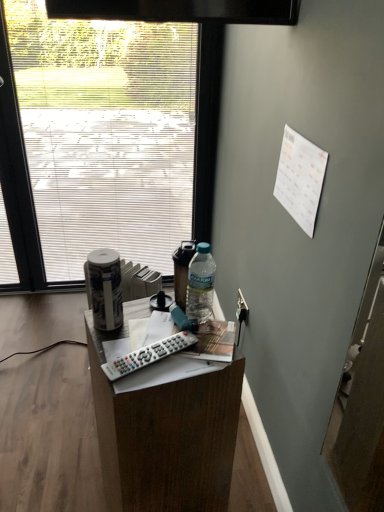
What do you see at coordinates (105, 288) in the screenshot? I see `white glossy canister at left` at bounding box center [105, 288].

At what (x,y) coordinates should I click in order to perform the action: click on white plastic remote control at center. Please return your answer as a coordinate pair (x, y). The width and height of the screenshot is (384, 512). Looking at the image, I should click on [x=148, y=355].

This screenshot has height=512, width=384. I want to click on black plastic power outlet at lower right, so click(x=242, y=309).

You are a GUI agent. You are given a task and a screenshot of the screen. Output one action in this format:
    pyautogui.click(x=<x>, y=<y>)
    Task: Click on the wooden desk at center
    The width and height of the screenshot is (384, 512).
    Given the screenshot: What is the action you would take?
    pyautogui.click(x=165, y=434)

You are a GUI agent. You are given a task and a screenshot of the screen. Output one action in this format:
    pyautogui.click(x=<x>, y=<y>)
    Task: Click on the bottle above the frosted glass window at upper left (from a real-world perspective)
    
    Given the screenshot: What is the action you would take?
    pyautogui.click(x=105, y=288)

Measure the distance from white glossy canister at left to frosted glass window at upper left.

5.74 feet.

Is white glossy canister at left next to frosted glass window at upper left and touching it?

No, white glossy canister at left is not in contact with frosted glass window at upper left.

From a real-world perspective, is white glossy canister at left above or below frosted glass window at upper left?

In terms of real-world spatial position, white glossy canister at left is above frosted glass window at upper left.

Is black plastic power outlet at lower right facing away from white glossy canister at left?

No, black plastic power outlet at lower right is not facing away from white glossy canister at left.

From a real-world perspective, which is physically above, black plastic power outlet at lower right or white glossy canister at left?

white glossy canister at left is physically above.

Does black plastic power outlet at lower right lie behind white glossy canister at left?

Yes, the depth of black plastic power outlet at lower right is greater than that of white glossy canister at left.

From the image's perspective, does black plastic power outlet at lower right appear lower than white glossy canister at left?

Yes, from the image's perspective, black plastic power outlet at lower right is beneath white glossy canister at left.

Looking at this image, which of these two, wooden desk at center or frosted glass window at upper left, stands shorter?

Standing shorter between the two is wooden desk at center.

Is wooden desk at center not close to frosted glass window at upper left?

wooden desk at center is positioned a significant distance from frosted glass window at upper left.

Between wooden desk at center and frosted glass window at upper left, which one is positioned in front?

wooden desk at center is closer to the camera.

Considering the positions of objects frosted glass window at upper left and black plastic power outlet at lower right in the image provided, who is more to the left, frosted glass window at upper left or black plastic power outlet at lower right?

frosted glass window at upper left is more to the left.

Could you measure the distance between frosted glass window at upper left and black plastic power outlet at lower right?

The distance of frosted glass window at upper left from black plastic power outlet at lower right is 5.17 feet.

Considering the relative positions of frosted glass window at upper left and black plastic power outlet at lower right in the image provided, is frosted glass window at upper left in front of black plastic power outlet at lower right?

No, frosted glass window at upper left is further to the viewer.

Is point (165, 153) closer to camera compared to point (245, 312)?

No, (165, 153) is behind (245, 312).

Which of these two, white glossy canister at left or black plastic power outlet at lower right, is smaller?

black plastic power outlet at lower right.

Can we say white glossy canister at left lies outside black plastic power outlet at lower right?

Indeed, white glossy canister at left is completely outside black plastic power outlet at lower right.

Is white glossy canister at left taller or shorter than black plastic power outlet at lower right?

Clearly, white glossy canister at left is taller compared to black plastic power outlet at lower right.

Is white plastic remote control at center turned away from white glossy canister at left?

That's not correct — white plastic remote control at center is not looking away from white glossy canister at left.

Is white plastic remote control at center bigger than white glossy canister at left?

Actually, white plastic remote control at center might be smaller than white glossy canister at left.

Is white plastic remote control at center in front of white glossy canister at left?

Yes, white plastic remote control at center is in front of white glossy canister at left.

Looking at this image, are white plastic remote control at center and white glossy canister at left beside each other?

white plastic remote control at center and white glossy canister at left are not in contact.

Which object is closer to the camera taking this photo, black plastic power outlet at lower right or frosted glass window at upper left?

black plastic power outlet at lower right is more forward.

Considering the positions of points (240, 301) and (150, 90), is point (240, 301) closer to camera compared to point (150, 90)?

Yes, point (240, 301) is in front of point (150, 90).

How far apart are black plastic power outlet at lower right and frosted glass window at upper left?

They are 5.17 feet apart.

Where is `power outlet on the right of frosted glass window at upper left`? Image resolution: width=384 pixels, height=512 pixels. power outlet on the right of frosted glass window at upper left is located at coordinates (242, 309).

Image resolution: width=384 pixels, height=512 pixels. What are the coordinates of `window above the white glossy canister at left (from the image's perspective)` in the screenshot? It's located at (103, 141).

The width and height of the screenshot is (384, 512). What are the coordinates of `bottle in front of the black plastic power outlet at lower right` in the screenshot? It's located at (105, 288).

Which object lies further to the anchor point frosted glass window at upper left, white plastic remote control at center or wooden desk at center?

white plastic remote control at center is positioned further to the anchor frosted glass window at upper left.

Considering their positions, is frosted glass window at upper left positioned closer to white glossy canister at left than white plastic remote control at center?

white plastic remote control at center.

When comparing their distances from black plastic power outlet at lower right, does wooden desk at center or frosted glass window at upper left seem further?

The object further to black plastic power outlet at lower right is frosted glass window at upper left.

Estimate the real-world distances between objects in this image. Which object is closer to white glossy canister at left, wooden desk at center or black plastic power outlet at lower right?

Among the two, wooden desk at center is located nearer to white glossy canister at left.

From the image, which object appears to be nearer to white glossy canister at left, white plastic remote control at center or wooden desk at center?

white plastic remote control at center is positioned closer to the anchor white glossy canister at left.

Looking at the image, which one is located further to white glossy canister at left, white plastic remote control at center or frosted glass window at upper left?

The object further to white glossy canister at left is frosted glass window at upper left.

Considering their positions, is frosted glass window at upper left positioned closer to white glossy canister at left than wooden desk at center?

Based on the image, wooden desk at center appears to be nearer to white glossy canister at left.

Which object lies further to the anchor point frosted glass window at upper left, white plastic remote control at center or white glossy canister at left?

Among the two, white plastic remote control at center is located further to frosted glass window at upper left.

This screenshot has width=384, height=512. I want to click on remote control between wooden desk at center and black plastic power outlet at lower right in the front-back direction, so click(x=148, y=355).

Find the location of a particular element. The image size is (384, 512). power outlet between white plastic remote control at center and frosted glass window at upper left in the front-back direction is located at coordinates (242, 309).

Find the location of `remote control between white glossy canister at left and wooden desk at center from top to bottom`. remote control between white glossy canister at left and wooden desk at center from top to bottom is located at coordinates (148, 355).

Locate an element on the screen. bottle located between wooden desk at center and frosted glass window at upper left in the depth direction is located at coordinates 105,288.